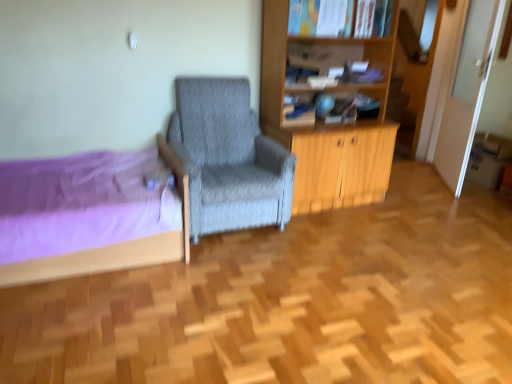
Question: Is matte blue book at upper center, which is counted as the 1th book, starting from the left, inside or outside of hardcover book at upper center, which ranks as the first book in right-to-left order?

Choices:
 (A) inside
 (B) outside

Answer: (B)

Question: Looking at their shapes, would you say matte blue book at upper center, which is counted as the 1th book, starting from the left, is wider or thinner than hardcover book at upper center, which ranks as the first book in right-to-left order?

Choices:
 (A) thin
 (B) wide

Answer: (A)

Question: Which object is the farthest from the gray fabric chair at center?

Choices:
 (A) hardcover book at upper center, which ranks as the first book in right-to-left order
 (B) matte blue book at upper center, which is the 1th book in bottom-to-top order
 (C) purple fabric bed at left

Answer: (A)

Question: Which object is the farthest from the purple fabric bed at left?

Choices:
 (A) matte blue book at upper center, marked as the 2th book in a top-to-bottom arrangement
 (B) gray fabric chair at center
 (C) hardcover book at upper center, which is the 2th book from left to right

Answer: (C)